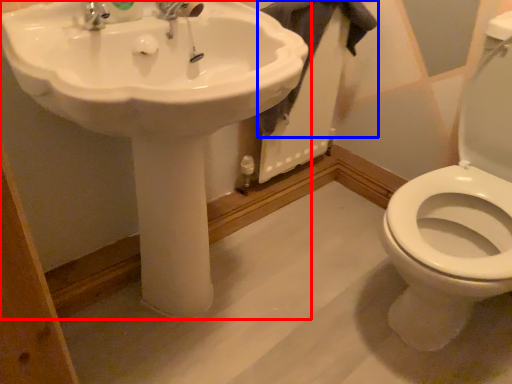
Question: Among these objects, which one is farthest to the camera, sink (highlighted by a red box) or bath towel (highlighted by a blue box)?

Choices:
 (A) sink
 (B) bath towel

Answer: (B)